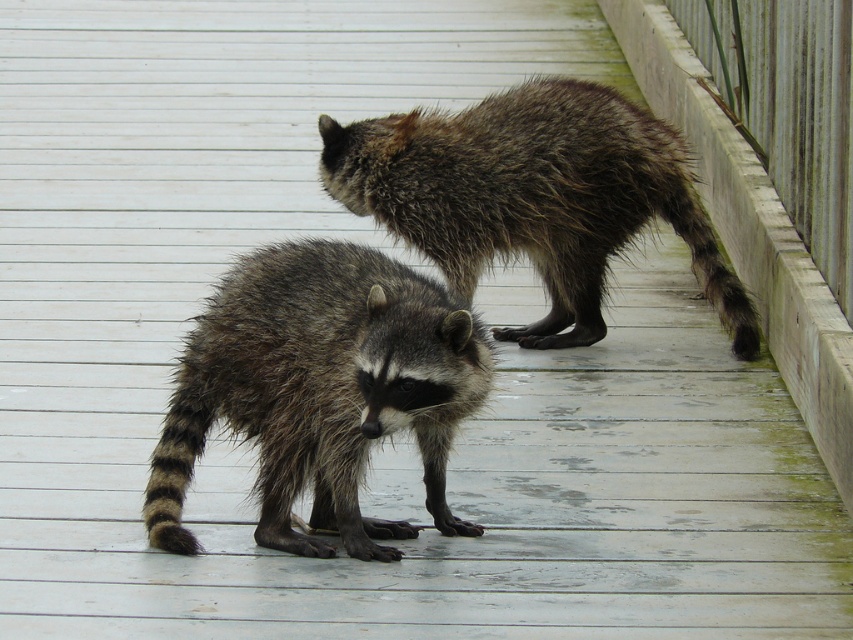
You are a wildlife photographer trying to capture both the rough fur raccoon at center and the fuzzy brown raccoon at upper center in a single frame. Based on their sizes, which raccoon will appear smaller in the photo?

The rough fur raccoon at center will appear smaller in the photo because its width is less than that of the fuzzy brown raccoon at upper center.

You are trying to determine which raccoon is closer to you based on their sizes. You see the rough fur raccoon at center and the fuzzy brown raccoon at upper center. Which one is closer?

The rough fur raccoon at center is smaller in size compared to the fuzzy brown raccoon at upper center, so the rough fur raccoon at center is closer to you since smaller objects appear closer in a 2D image.

You are a photographer trying to capture both the rough fur raccoon at center and the fuzzy brown raccoon at upper center in a single shot. Based on their positions, which raccoon is closer to the camera?

The rough fur raccoon at center is closer to the camera because it is positioned under the fuzzy brown raccoon at upper center, indicating it is in front.